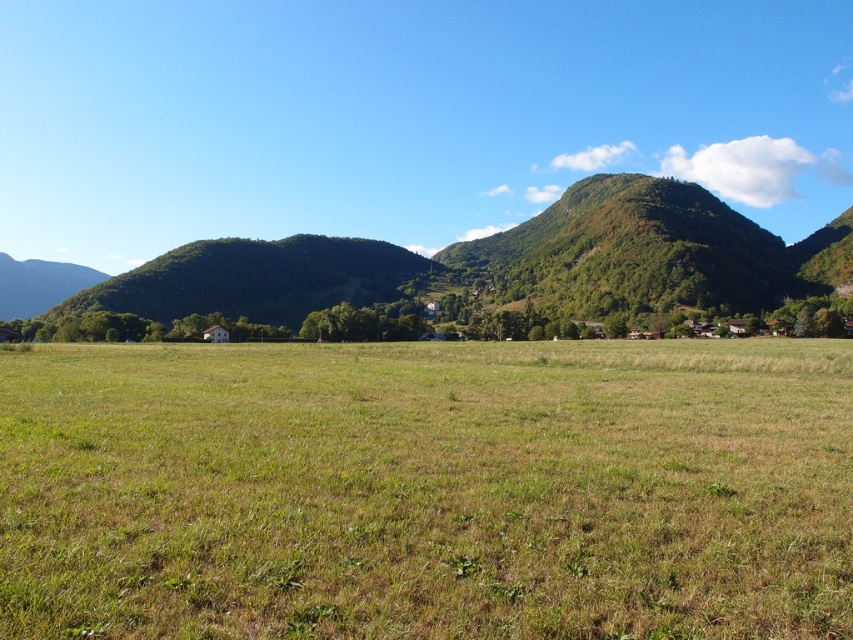
You are standing in the middle of the green grass pasture at center and want to walk towards the green grassy hill at center. Which direction should you head to reach the hill?

The green grassy hill at center is above the green grass pasture at center, so you should head upwards to reach the hill.

You are a farmer checking the growth of your crops. You notice two areas of green grass pasture at center and green grassy hill at center. Which area has shorter grass?

The green grass pasture at center has shorter grass than the green grassy hill at center since the pasture is not as tall as the hill.

You are standing in the middle of the green grass pasture at center and want to walk towards the green grassy hill at center. Which direction should you head?

Since the green grass pasture at center is in front of the green grassy hill at center, you should head forward to reach the green grassy hill at center.